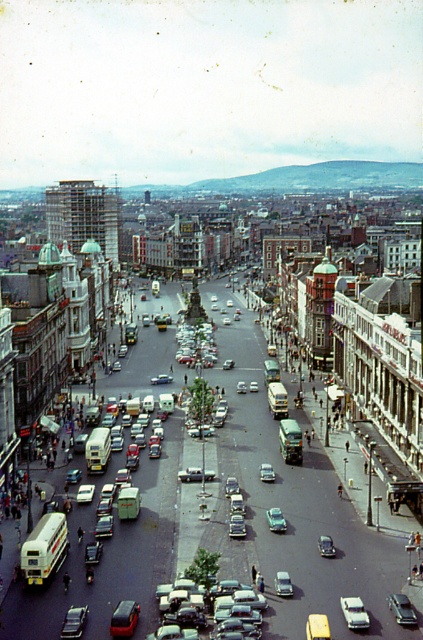
You are a pedestrian standing at the edge of the road. You see a metallic silver bus at center and a metallic silver car at center. If you want to cross the road safely, which vehicle should you wait until it passes before proceeding?

You should wait for the metallic silver bus at center to pass first because it is farther away from the metallic silver car at center by 21.84 meters, meaning it will take longer to reach your position.

You are a pedestrian standing on the sidewalk and see both the metallic silver car at center and the silver metallic sedan at center. Which one is closer to the left side of the road?

The metallic silver car at center is positioned on the left side of the silver metallic sedan at center, so it is closer to the left side of the road.